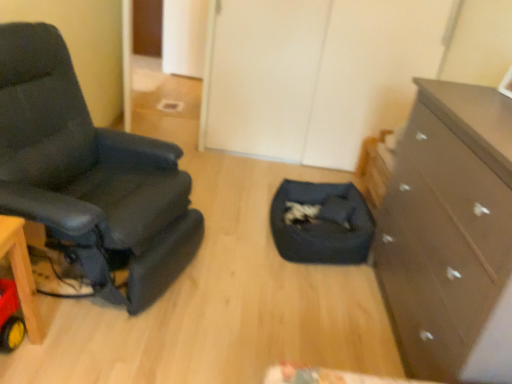
Identify the location of vacant area that lies between black leather chair at left and dark blue fabric pet bed at center. (245, 256).